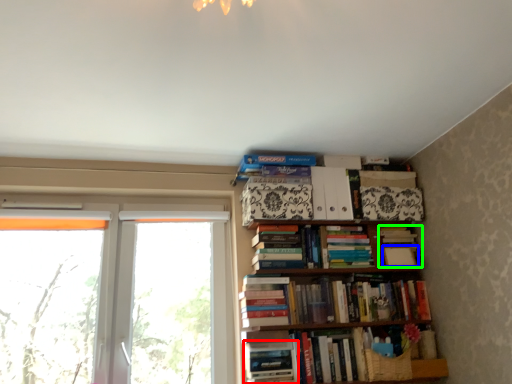
Question: Which is nearer to the book (highlighted by a red box)? paperback book (highlighted by a blue box) or book (highlighted by a green box).

Choices:
 (A) paperback book
 (B) book

Answer: (B)